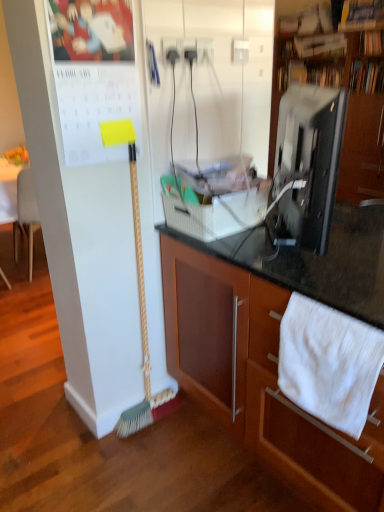
What are the coordinates of `free location in front of green bristle broom at left` in the screenshot? It's located at [x=144, y=452].